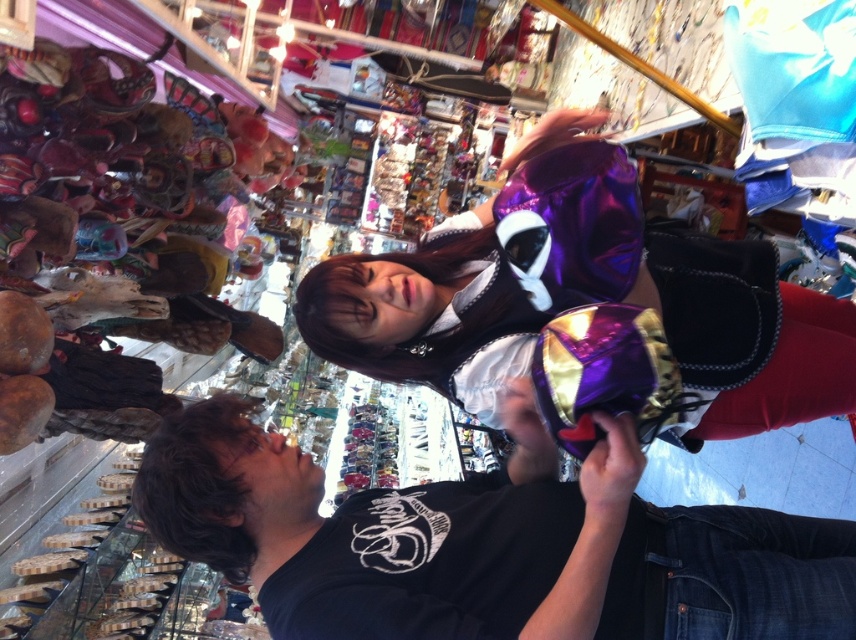
Is black matte shirt at lower center positioned at the back of shiny purple dress at center?

No.

Is black matte shirt at lower center above shiny purple dress at center?

No.

Find the location of a particular element. This screenshot has width=856, height=640. black matte shirt at lower center is located at coordinates (486, 544).

Image resolution: width=856 pixels, height=640 pixels. I want to click on black matte shirt at lower center, so click(486, 544).